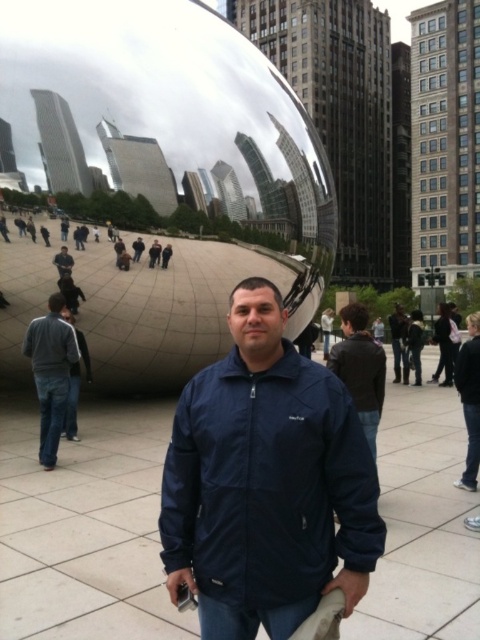
Between dark gray sweater at left and matte black jacket at center, which one appears on the right side from the viewer's perspective?

From the viewer's perspective, dark gray sweater at left appears more on the right side.

Who is shorter, dark gray sweater at left or matte black jacket at center?

matte black jacket at center is shorter.

Measure the distance between point (43,442) and camera.

Point (43,442) and camera are 15.03 meters apart from each other.

Find the location of a particular element. dark gray sweater at left is located at coordinates tap(50, 372).

In the scene shown: Is navy blue jacket at center closer to camera compared to matte black jacket at center?

That is True.

Is point (301, 419) farther from viewer compared to point (55, 260)?

No, it is not.

You are a GUI agent. You are given a task and a screenshot of the screen. Output one action in this format:
    pyautogui.click(x=<x>, y=<y>)
    Task: Click on the navy blue jacket at center
    This screenshot has width=480, height=640.
    Given the screenshot: What is the action you would take?
    pyautogui.click(x=267, y=483)

What do you see at coordinates (256, 321) in the screenshot? I see `matte blue jacket at center` at bounding box center [256, 321].

Between point (250, 314) and point (54, 294), which one is positioned in front?

Point (250, 314) is more forward.

Find the location of a particular element. This screenshot has width=480, height=640. matte blue jacket at center is located at coordinates (256, 321).